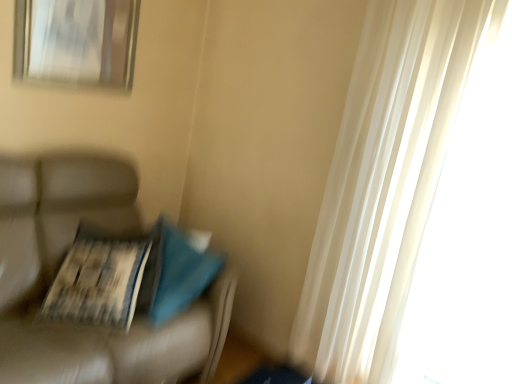
In order to click on printed paper magazine at left in this screenshot , I will do `click(100, 280)`.

Who is bigger, leather couch at left or metallic silver picture frame at upper left?

Bigger between the two is leather couch at left.

Can you see leather couch at left touching metallic silver picture frame at upper left?

No, leather couch at left is not beside metallic silver picture frame at upper left.

Is leather couch at left closer to camera compared to metallic silver picture frame at upper left?

Yes, it is.

How different are the orientations of leather couch at left and metallic silver picture frame at upper left in degrees?

They differ by 1.54 degrees in their facing directions.

Does point (17, 63) come closer to viewer compared to point (122, 314)?

No, (17, 63) is behind (122, 314).

Between metallic silver picture frame at upper left and printed paper magazine at left, which one has more height?

With more height is metallic silver picture frame at upper left.

Is metallic silver picture frame at upper left wider or thinner than printed paper magazine at left?

Considering their sizes, metallic silver picture frame at upper left looks slimmer than printed paper magazine at left.

Is printed paper magazine at left directly adjacent to leather couch at left?

printed paper magazine at left and leather couch at left are not in contact.

Can you confirm if printed paper magazine at left is smaller than leather couch at left?

Correct, printed paper magazine at left occupies less space than leather couch at left.

Is printed paper magazine at left behind leather couch at left?

Yes, it is.

Is point (139, 241) positioned before point (123, 377)?

No, it is behind (123, 377).

Considering the sizes of leather couch at left and printed paper magazine at left in the image, is leather couch at left bigger or smaller than printed paper magazine at left?

Considering their sizes, leather couch at left takes up more space than printed paper magazine at left.

Could you tell me if leather couch at left is turned towards printed paper magazine at left?

Yes, leather couch at left is turned towards printed paper magazine at left.

Considering the sizes of objects leather couch at left and printed paper magazine at left in the image provided, who is taller, leather couch at left or printed paper magazine at left?

leather couch at left.

Is leather couch at left far from printed paper magazine at left?

No, leather couch at left is not far away from printed paper magazine at left.

From the image's perspective, does metallic silver picture frame at upper left appear lower than leather couch at left?

No, from the image's perspective, metallic silver picture frame at upper left is not below leather couch at left.

Is metallic silver picture frame at upper left shorter than leather couch at left?

Yes, metallic silver picture frame at upper left is shorter than leather couch at left.

In terms of size, does metallic silver picture frame at upper left appear bigger or smaller than leather couch at left?

Clearly, metallic silver picture frame at upper left is smaller in size than leather couch at left.

Is metallic silver picture frame at upper left positioned behind leather couch at left?

Yes, metallic silver picture frame at upper left is further from the viewer.

Is printed paper magazine at left not near metallic silver picture frame at upper left?

Actually, printed paper magazine at left and metallic silver picture frame at upper left are a little close together.

From their relative heights in the image, would you say printed paper magazine at left is taller or shorter than metallic silver picture frame at upper left?

Considering their sizes, printed paper magazine at left has less height than metallic silver picture frame at upper left.

From the image's perspective, is printed paper magazine at left on top of metallic silver picture frame at upper left?

Incorrect, from the image's perspective, printed paper magazine at left is lower than metallic silver picture frame at upper left.

Between point (106, 236) and point (21, 24), which one is positioned in front?

The point (21, 24) is more forward.

Find the location of `furniture below the metallic silver picture frame at upper left (from the image's perspective)`. furniture below the metallic silver picture frame at upper left (from the image's perspective) is located at coordinates (58, 267).

Locate an element on the screen. The image size is (512, 384). picture frame above the printed paper magazine at left (from a real-world perspective) is located at coordinates (76, 42).

Consider the image. When comparing their distances from printed paper magazine at left, does leather couch at left or metallic silver picture frame at upper left seem further?

The object further to printed paper magazine at left is metallic silver picture frame at upper left.

Based on their spatial positions, is leather couch at left or printed paper magazine at left further from metallic silver picture frame at upper left?

Answer: printed paper magazine at left lies further to metallic silver picture frame at upper left than the other object.

Estimate the real-world distances between objects in this image. Which object is further from leather couch at left, printed paper magazine at left or metallic silver picture frame at upper left?

Among the two, metallic silver picture frame at upper left is located further to leather couch at left.

Considering their positions, is printed paper magazine at left positioned closer to metallic silver picture frame at upper left than leather couch at left?

leather couch at left lies closer to metallic silver picture frame at upper left than the other object.

Based on their spatial positions, is metallic silver picture frame at upper left or printed paper magazine at left closer to leather couch at left?

The object closer to leather couch at left is printed paper magazine at left.

Considering their positions, is metallic silver picture frame at upper left positioned closer to printed paper magazine at left than leather couch at left?

Among the two, leather couch at left is located nearer to printed paper magazine at left.

What are the coordinates of `magazine between metallic silver picture frame at upper left and leather couch at left in the up-down direction` in the screenshot? It's located at (100, 280).